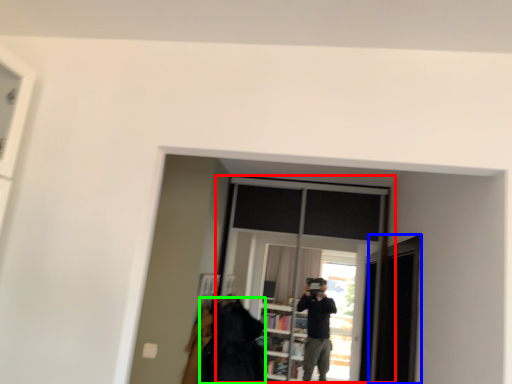
Question: Estimate the real-world distances between objects in this image. Which object is closer to window (highlighted by a red box), screen door (highlighted by a blue box) or clothing (highlighted by a green box)?

Choices:
 (A) screen door
 (B) clothing

Answer: (B)